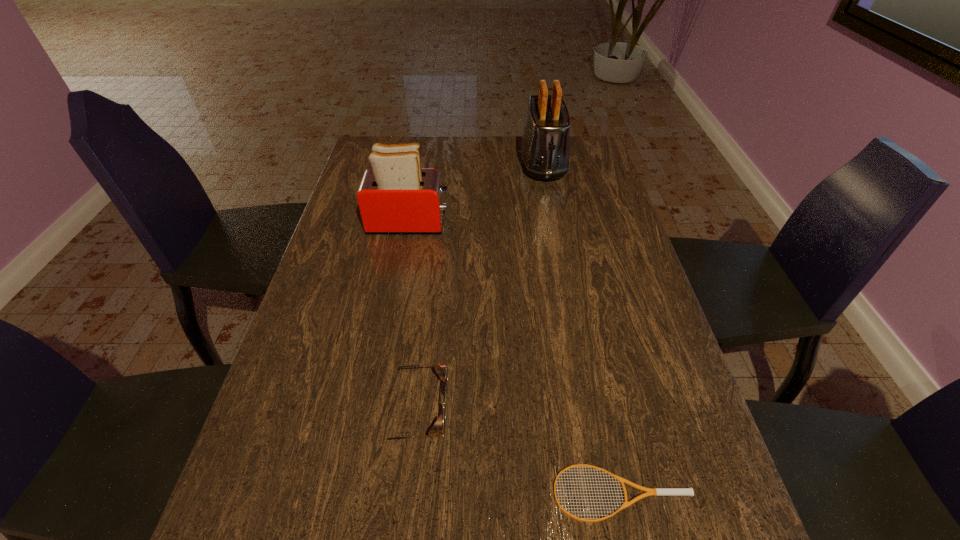
This screenshot has width=960, height=540. I want to click on the farthest object, so click(x=545, y=146).

Where is `the farther toaster`? the farther toaster is located at coordinates (545, 146).

Identify the location of the left toaster. This screenshot has height=540, width=960. (396, 196).

In order to click on the nearer toaster in this screenshot , I will do `click(396, 196)`.

The width and height of the screenshot is (960, 540). I want to click on the third tallest object, so click(441, 369).

The width and height of the screenshot is (960, 540). I want to click on sunglasses, so click(x=441, y=369).

At what (x,y) coordinates should I click in order to perform the action: click on the shortest object. Please return your answer as a coordinate pair (x, y). The width and height of the screenshot is (960, 540). Looking at the image, I should click on (648, 491).

In order to click on tennis racket in this screenshot , I will do `click(648, 491)`.

In order to click on free space located 0.390m on the side of the right toaster with the control lever in this screenshot , I will do `click(564, 269)`.

Image resolution: width=960 pixels, height=540 pixels. Find the location of `free space located 0.050m on the front-facing side of the left toaster`. free space located 0.050m on the front-facing side of the left toaster is located at coordinates (467, 223).